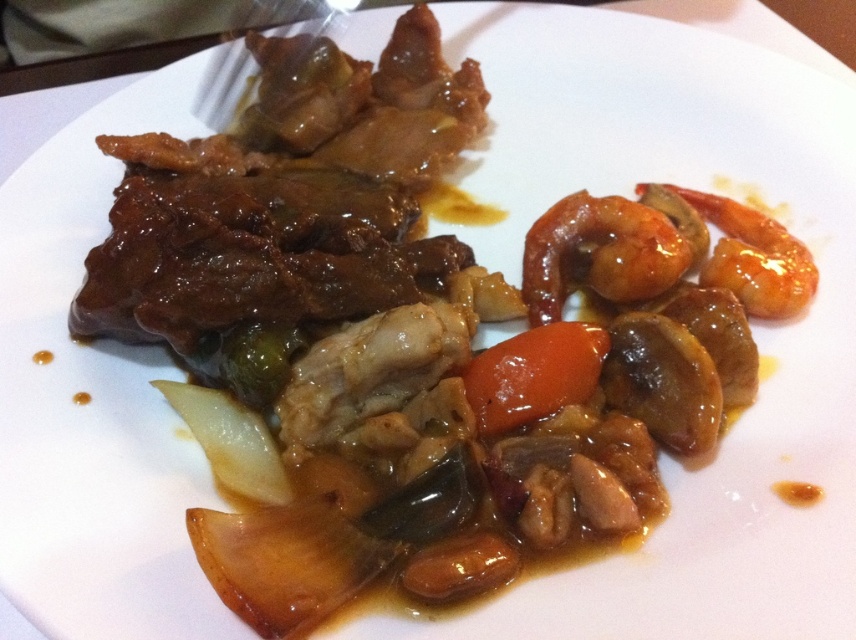
Can you confirm if glossy orange carrot at center is positioned to the left of metallic silver fork at upper left?

No, glossy orange carrot at center is not to the left of metallic silver fork at upper left.

Is glossy orange carrot at center above metallic silver fork at upper left?

No.

You are a GUI agent. You are given a task and a screenshot of the screen. Output one action in this format:
    pyautogui.click(x=<x>, y=<y>)
    Task: Click on the glossy orange carrot at center
    The image size is (856, 640).
    Given the screenshot: What is the action you would take?
    pyautogui.click(x=533, y=374)

Is glossy orange shrimp at upper right above metallic silver fork at upper left?

No, glossy orange shrimp at upper right is not above metallic silver fork at upper left.

Between glossy orange shrimp at upper right and metallic silver fork at upper left, which one appears on the right side from the viewer's perspective?

glossy orange shrimp at upper right

Where is `glossy orange shrimp at upper right`? The height and width of the screenshot is (640, 856). glossy orange shrimp at upper right is located at coordinates (599, 252).

Does point (420, 118) come closer to viewer compared to point (318, 3)?

Yes, it is in front of point (318, 3).

At what (x,y) coordinates should I click in order to perform the action: click on glossy brown meat at upper left. Please return your answer as a coordinate pair (x, y). This screenshot has height=640, width=856. Looking at the image, I should click on (284, 195).

Find the location of a particular element. The width and height of the screenshot is (856, 640). glossy brown meat at upper left is located at coordinates (284, 195).